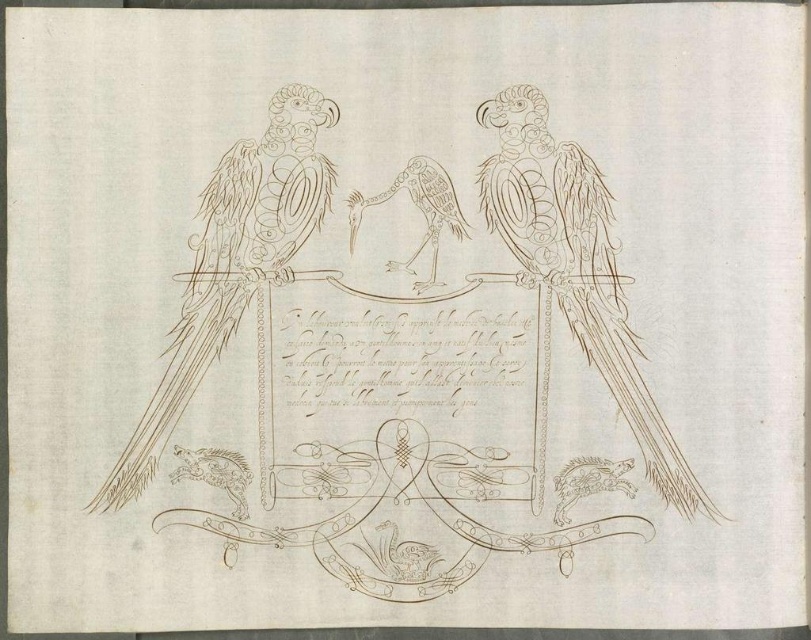
Based on the scene described, which parrot has a larger size between the brown textured parrot at center and the smooth brown parrot at center?

The brown textured parrot at center is larger than the smooth brown parrot at center according to the description.